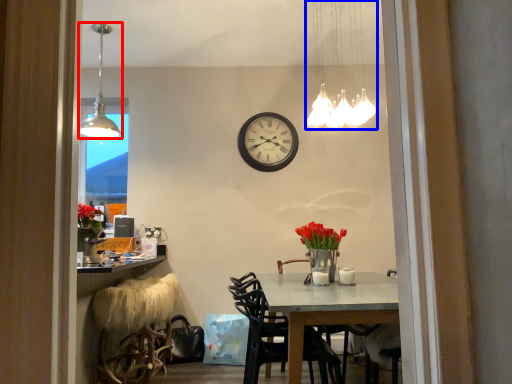
Question: Which object appears farthest to the camera in this image, lamp (highlighted by a red box) or lamp (highlighted by a blue box)?

Choices:
 (A) lamp
 (B) lamp

Answer: (A)